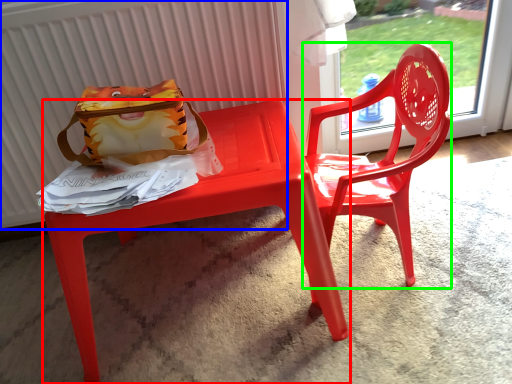
Question: Estimate the real-world distances between objects in this image. Which object is closer to table (highlighted by a red box), radiator (highlighted by a blue box) or chair (highlighted by a green box)?

Choices:
 (A) radiator
 (B) chair

Answer: (B)